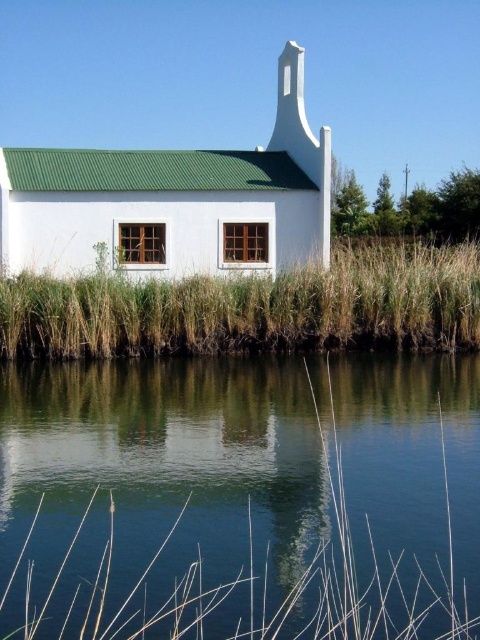
Question: Which of the following is the farthest from the observer?

Choices:
 (A) brown grass at lower center
 (B) white matte church at center

Answer: (B)

Question: Based on their relative distances, which object is farther from the clear blue water at lower center?

Choices:
 (A) brown grass at lower center
 (B) white matte church at center

Answer: (B)

Question: Observing the image, what is the correct spatial positioning of white matte church at center in reference to brown grass at lower center?

Choices:
 (A) right
 (B) left

Answer: (B)

Question: Which point is closer to the camera taking this photo?

Choices:
 (A) (142, 179)
 (B) (96, 586)

Answer: (B)

Question: Is clear blue water at lower center smaller than white matte church at center?

Choices:
 (A) yes
 (B) no

Answer: (A)

Question: Does clear blue water at lower center have a greater width compared to brown grass at lower center?

Choices:
 (A) yes
 (B) no

Answer: (B)